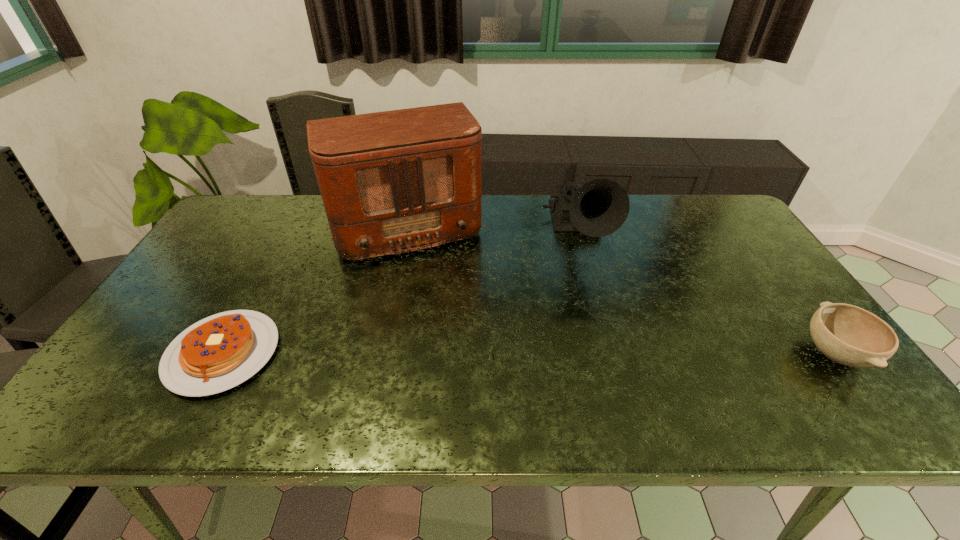
Where is `object that is at the near left corner`? Image resolution: width=960 pixels, height=540 pixels. object that is at the near left corner is located at coordinates (219, 352).

Find the location of `object situated at the near right corner`. object situated at the near right corner is located at coordinates (846, 334).

Find the location of a particular element. vacant area at the far edge of the desktop is located at coordinates (645, 205).

The height and width of the screenshot is (540, 960). In the image, there is a desktop. What are the coordinates of `vacant region at the right edge` in the screenshot? It's located at (768, 301).

At what (x,y) coordinates should I click in order to perform the action: click on free space at the near left corner. Please return your answer as a coordinate pair (x, y). The width and height of the screenshot is (960, 540). Looking at the image, I should click on (116, 376).

Where is `free space at the far right corner of the desktop`? free space at the far right corner of the desktop is located at coordinates (726, 212).

Image resolution: width=960 pixels, height=540 pixels. Identify the location of free space at the near right corner of the desktop. (831, 364).

I want to click on vacant area between the second tallest object and the pancake, so click(401, 294).

The image size is (960, 540). Identify the location of vacant region between the tallest object and the phonograph_record. (491, 232).

You are a GUI agent. You are given a task and a screenshot of the screen. Output one action in this format:
    pyautogui.click(x=<x>, y=<y>)
    Task: Click on the vacant space that is in between the tallest object and the second tallest object
    The image size is (960, 540).
    Given the screenshot: What is the action you would take?
    pyautogui.click(x=491, y=232)